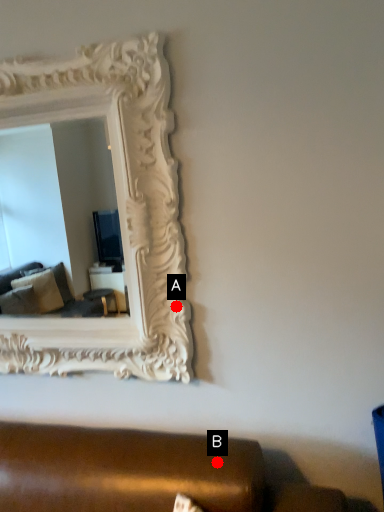
Question: Two points are circled on the image, labeled by A and B beside each circle. Among these points, which one is farthest from the camera?

Choices:
 (A) A is further
 (B) B is further

Answer: (A)